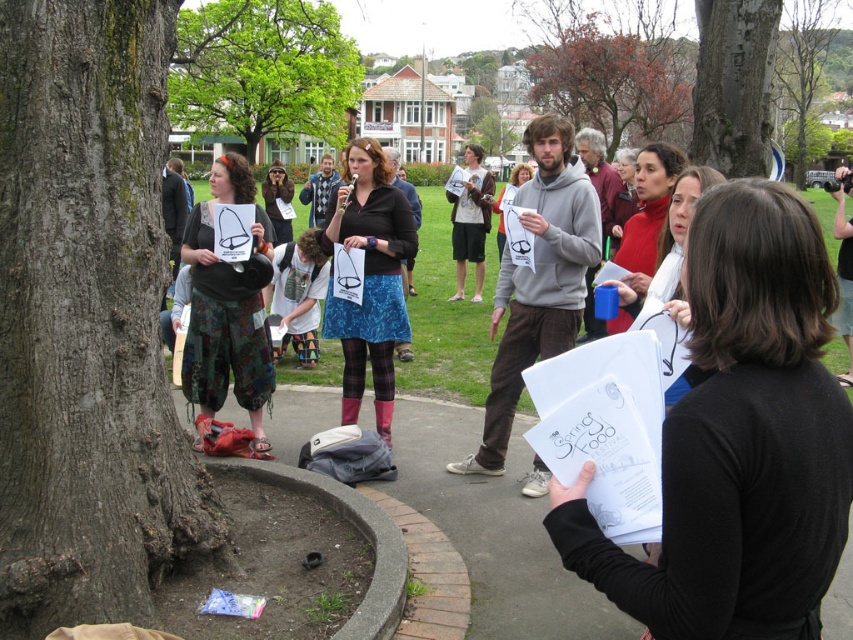
Question: Is dark brown bark tree at left thinner than matte black skirt at center?

Choices:
 (A) yes
 (B) no

Answer: (B)

Question: Which object is the farthest from the matte black shirt at center?

Choices:
 (A) camouflage pants at left
 (B) green leafy tree at upper left

Answer: (B)

Question: Is matte black skirt at center to the left of camouflage pants at left from the viewer's perspective?

Choices:
 (A) no
 (B) yes

Answer: (A)

Question: Among these objects, which one is nearest to the camera?

Choices:
 (A) green leafy tree at upper left
 (B) dark brown bark tree at left

Answer: (B)

Question: Is black paper at center thinner than matte black jacket at center?

Choices:
 (A) yes
 (B) no

Answer: (B)

Question: Which point is farther from the camera taking this photo?

Choices:
 (A) (798, 90)
 (B) (270, 376)
 (C) (140, 348)
 (D) (532, 58)

Answer: (D)